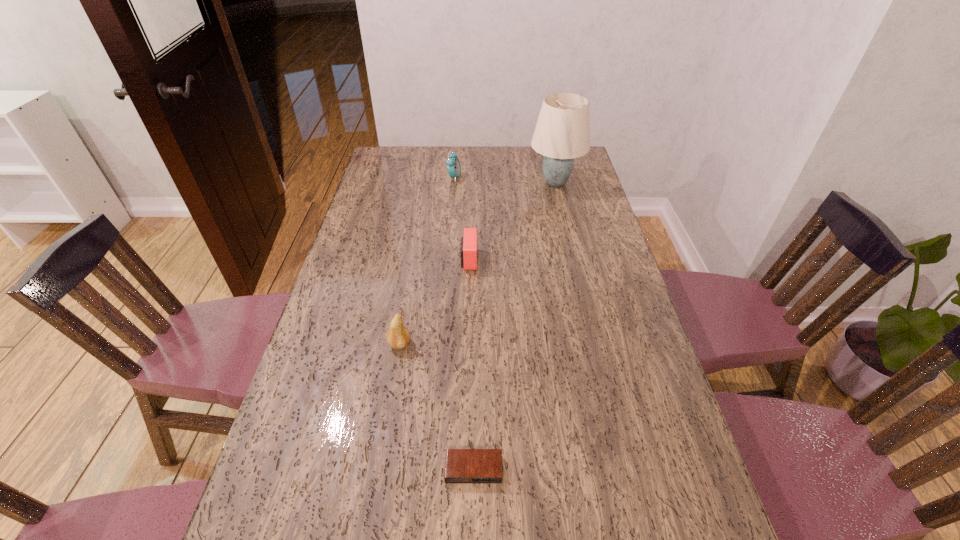
In the image, there is a desktop. Where is `vacant region at the left edge`? This screenshot has height=540, width=960. vacant region at the left edge is located at coordinates (326, 366).

The image size is (960, 540). In the image, there is a desktop. Identify the location of vacant space at the right edge. (585, 251).

At what (x,y) coordinates should I click in order to perform the action: click on vacant area at the far left corner of the desktop. Please return your answer as a coordinate pair (x, y). Looking at the image, I should click on (388, 169).

You are a GUI agent. You are given a task and a screenshot of the screen. Output one action in this format:
    pyautogui.click(x=<x>, y=<y>)
    Task: Click on the empty location between the lampshade and the leftmost object
    This screenshot has height=540, width=960.
    Given the screenshot: What is the action you would take?
    pyautogui.click(x=477, y=264)

You are a GUI agent. You are given a task and a screenshot of the screen. Output one action in this format:
    pyautogui.click(x=<x>, y=<y>)
    Task: Click on the free point between the rightmost object and the shortest alarm clock
    The width and height of the screenshot is (960, 540).
    Given the screenshot: What is the action you would take?
    pyautogui.click(x=515, y=326)

The width and height of the screenshot is (960, 540). Identify the location of free area in between the leftmost object and the second nearest alarm clock. (434, 302).

Where is `free space between the tallest alarm clock and the second tallest alarm clock`? free space between the tallest alarm clock and the second tallest alarm clock is located at coordinates (462, 219).

Where is `free spot between the nearest alarm clock and the third nearest object`? free spot between the nearest alarm clock and the third nearest object is located at coordinates (471, 364).

Where is `unoccupied area between the second object from left to right and the nearest alarm clock`? unoccupied area between the second object from left to right and the nearest alarm clock is located at coordinates (464, 323).

This screenshot has width=960, height=540. Find the location of `empty space that is in between the third nearest object and the tallest object`. empty space that is in between the third nearest object and the tallest object is located at coordinates (513, 221).